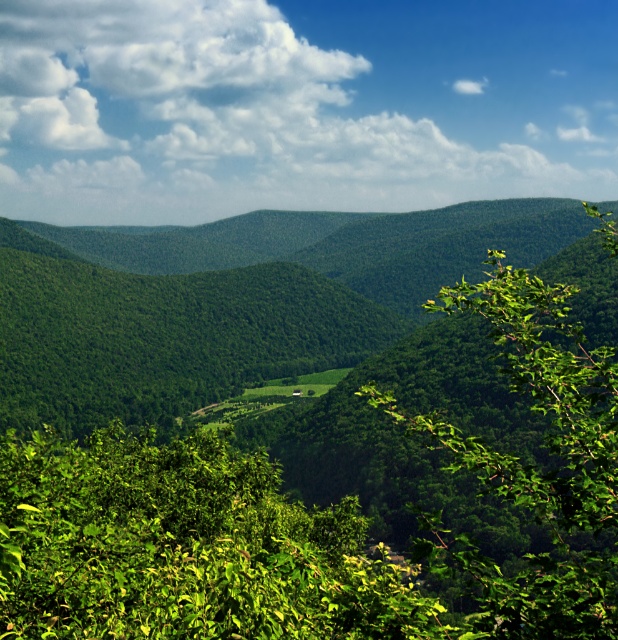
You are an airplane passenger looking out the window and see the white fluffy cloud at upper center and the green leafy tree at center. Which object is wider from your perspective?

The white fluffy cloud at upper center might be wider than the green leafy tree at center according to the description.

You are an astronomer analyzing the sky in the image. You need to determine the exact coordinates of the white fluffy cloud at upper center. What are its coordinates?

The white fluffy cloud at upper center is located at coordinates point [300,106].